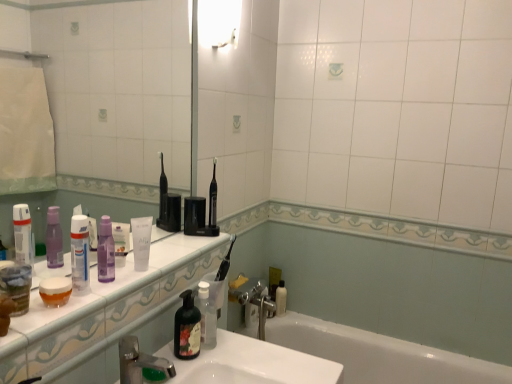
Question: Considering the relative sizes of purple translucent mouthwash at center, the second mouthwash viewed from the front, and white matte tube at center, which appears as the 4th toiletry when viewed from the back, in the image provided, is purple translucent mouthwash at center, the second mouthwash viewed from the front, taller than white matte tube at center, which appears as the 4th toiletry when viewed from the back,?

Choices:
 (A) no
 (B) yes

Answer: (A)

Question: From a real-world perspective, is purple translucent mouthwash at center, the 2th mouthwash ordered from the bottom, on top of white matte tube at center, placed as the second toiletry when sorted from front to back?

Choices:
 (A) yes
 (B) no

Answer: (B)

Question: Is purple translucent mouthwash at center, the 1th mouthwash in the back-to-front sequence, at the right side of white matte tube at center, placed as the 2th toiletry when sorted from left to right?

Choices:
 (A) no
 (B) yes

Answer: (A)

Question: Does purple translucent mouthwash at center, which is the 2th mouthwash from left to right, have a lesser width compared to white matte tube at center, placed as the second toiletry when sorted from front to back?

Choices:
 (A) no
 (B) yes

Answer: (B)

Question: Is purple translucent mouthwash at center, acting as the first mouthwash starting from the right, completely or partially outside of white matte tube at center, which appears as the 4th toiletry when viewed from the back?

Choices:
 (A) yes
 (B) no

Answer: (A)

Question: Is purple translucent mouthwash at center, the 1th mouthwash in the back-to-front sequence, smaller than white matte tube at center, which appears as the 4th toiletry when viewed from the back?

Choices:
 (A) yes
 (B) no

Answer: (A)

Question: Does white glossy bathtub at lower center turn towards white glossy light fixture at upper center?

Choices:
 (A) no
 (B) yes

Answer: (A)

Question: Is white glossy bathtub at lower center completely or partially outside of white glossy light fixture at upper center?

Choices:
 (A) no
 (B) yes

Answer: (B)

Question: Does white glossy bathtub at lower center have a smaller size compared to white glossy light fixture at upper center?

Choices:
 (A) yes
 (B) no

Answer: (B)

Question: Is white glossy bathtub at lower center wider than white glossy light fixture at upper center?

Choices:
 (A) no
 (B) yes

Answer: (B)

Question: Is white glossy bathtub at lower center facing away from white glossy light fixture at upper center?

Choices:
 (A) no
 (B) yes

Answer: (A)

Question: Does white glossy bathtub at lower center lie in front of white glossy light fixture at upper center?

Choices:
 (A) no
 (B) yes

Answer: (B)

Question: Is the depth of silver metallic faucet at lower center less than that of white matte tube at center, placed as the 2th toiletry when sorted from left to right?

Choices:
 (A) no
 (B) yes

Answer: (B)